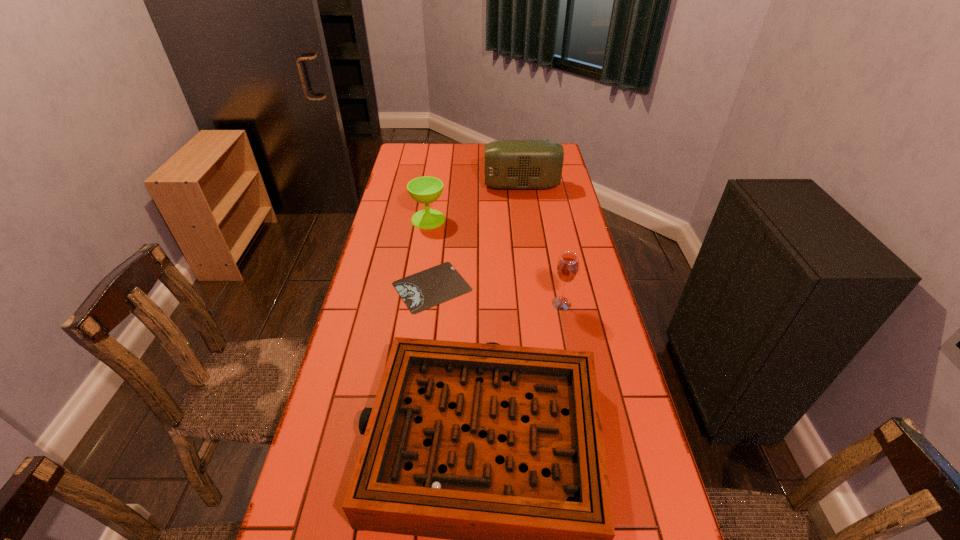
This screenshot has height=540, width=960. I want to click on radio_receiver, so coord(509,164).

Where is `the nearer wineglass`? The image size is (960, 540). the nearer wineglass is located at coordinates (567, 268).

Locate an element on the screen. Image resolution: width=960 pixels, height=540 pixels. the taller wineglass is located at coordinates (567, 268).

Where is `the second farthest object`? the second farthest object is located at coordinates (426, 189).

Locate an element on the screen. the third tallest object is located at coordinates (x=426, y=189).

What are the coordinates of `mousepad` in the screenshot? It's located at (420, 291).

Image resolution: width=960 pixels, height=540 pixels. In order to click on vacant space situated on the front-facing side of the radio_receiver in this screenshot , I will do `click(456, 186)`.

Locate an element on the screen. This screenshot has width=960, height=540. free location located 0.080m on the front-facing side of the radio_receiver is located at coordinates (466, 186).

Identify the location of blank space located on the front-facing side of the radio_receiver. This screenshot has height=540, width=960. (470, 186).

Identify the location of vacant space situated on the back of the nearer wineglass. The height and width of the screenshot is (540, 960). (546, 226).